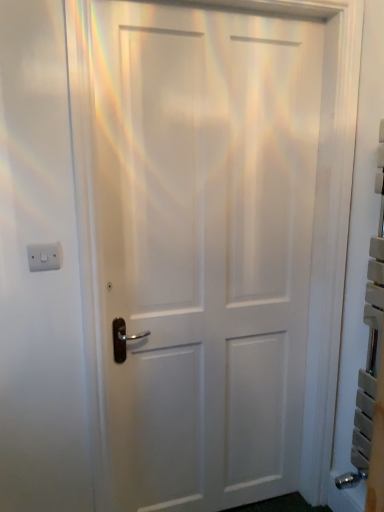
Question: Would you say white matte door at center is to the left or to the right of white plastic/light switch at upper left in the picture?

Choices:
 (A) left
 (B) right

Answer: (B)

Question: Looking at the image, does white matte door at center seem bigger or smaller compared to white plastic/light switch at upper left?

Choices:
 (A) big
 (B) small

Answer: (A)

Question: Relative to white plastic/light switch at upper left, is white matte door at center in front or behind?

Choices:
 (A) front
 (B) behind

Answer: (A)

Question: From a real-world perspective, is white plastic/light switch at upper left above or below white matte door at center?

Choices:
 (A) above
 (B) below

Answer: (A)

Question: Is white plastic/light switch at upper left in front of or behind white matte door at center in the image?

Choices:
 (A) behind
 (B) front

Answer: (A)

Question: In the image, is white plastic/light switch at upper left on the left side or the right side of white matte door at center?

Choices:
 (A) left
 (B) right

Answer: (A)

Question: Looking at their shapes, would you say white plastic/light switch at upper left is wider or thinner than white matte door at center?

Choices:
 (A) thin
 (B) wide

Answer: (A)